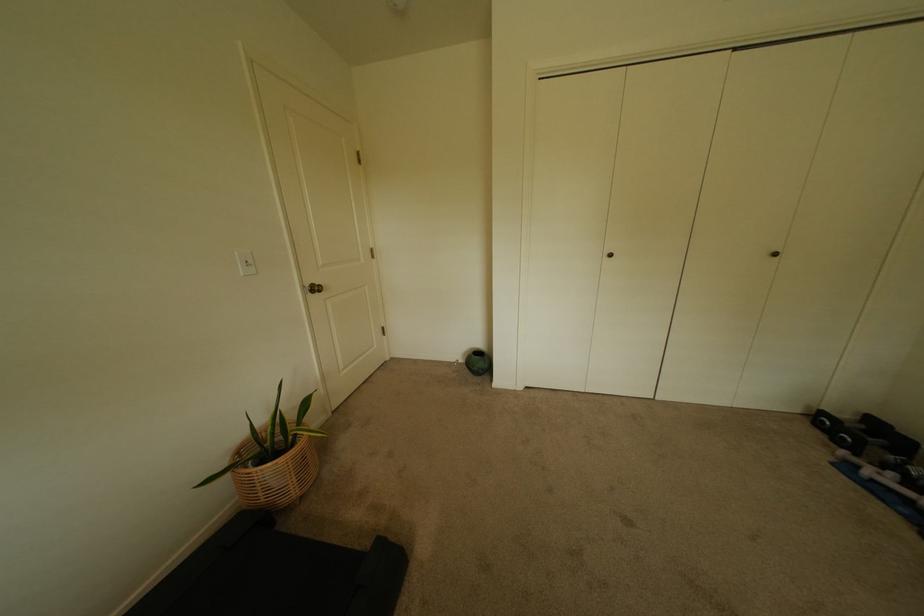
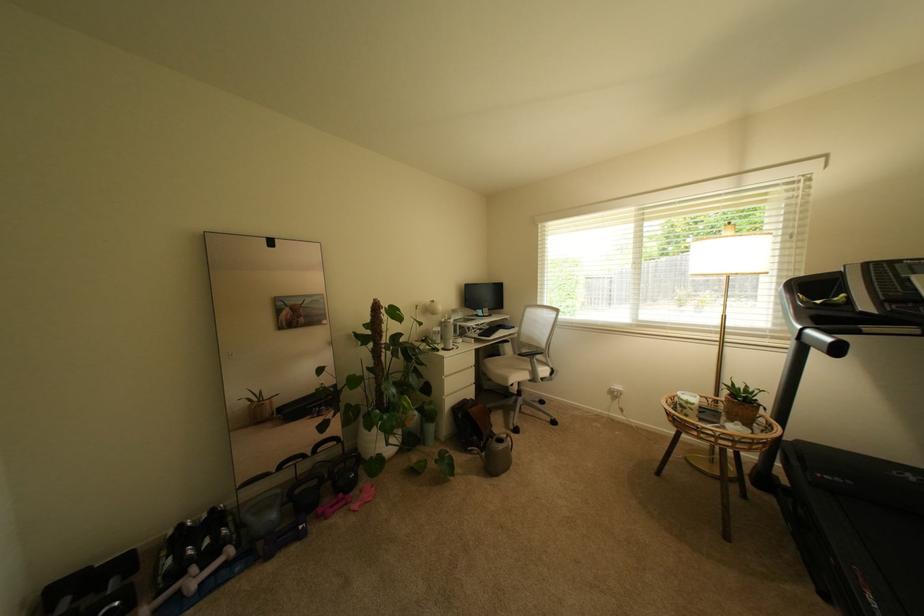
Where in the second image is the point corresponding to point 858,440 from the first image?

(126, 604)